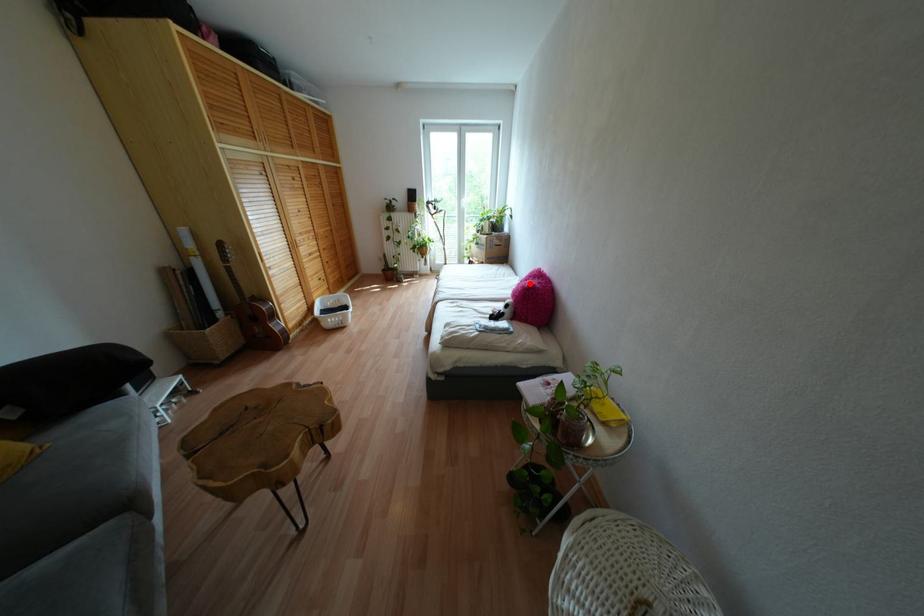
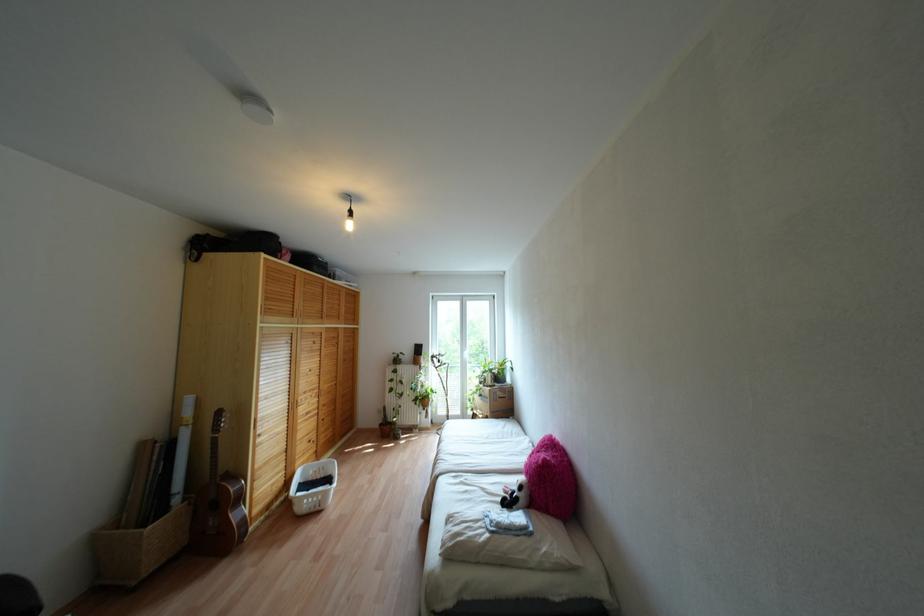
The point at the highlighted location is marked in the first image. Where is the corresponding point in the second image?

(543, 460)